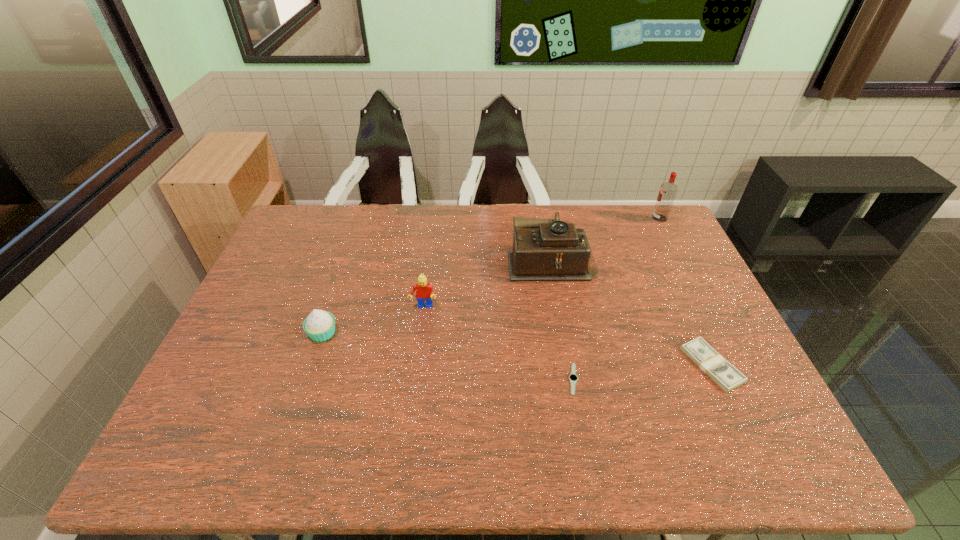
Where is `vacant space at the near left corner of the desktop`? vacant space at the near left corner of the desktop is located at coordinates (190, 461).

This screenshot has height=540, width=960. In the image, there is a desktop. In order to click on vacant region at the far right corner in this screenshot , I will do 647,224.

Image resolution: width=960 pixels, height=540 pixels. I want to click on empty location between the fifth object from right to left and the cupcake, so click(373, 320).

Where is `free space between the third farthest object and the second shortest object`? free space between the third farthest object and the second shortest object is located at coordinates (567, 336).

You are a GUI agent. You are given a task and a screenshot of the screen. Output one action in this format:
    pyautogui.click(x=<x>, y=<y>)
    Task: Click on the free space between the second shortest object and the shortest object
    This screenshot has height=540, width=960.
    Given the screenshot: What is the action you would take?
    pyautogui.click(x=642, y=372)

In order to click on vacant space that is in between the watch and the second shortest object in this screenshot , I will do `click(642, 372)`.

You are a GUI agent. You are given a task and a screenshot of the screen. Output one action in this format:
    pyautogui.click(x=<x>, y=<y>)
    Task: Click on the vacant area between the third shortest object and the third tallest object
    Image resolution: width=960 pixels, height=540 pixels.
    Given the screenshot: What is the action you would take?
    pyautogui.click(x=373, y=320)

Locate an element on the screen. The image size is (960, 540). blank region between the cupcake and the fifth nearest object is located at coordinates (437, 297).

You are a GUI agent. You are given a task and a screenshot of the screen. Output one action in this format:
    pyautogui.click(x=<x>, y=<y>)
    Task: Click on the vacant space that is in between the fifth tallest object and the fourth shortest object
    
    Given the screenshot: What is the action you would take?
    pyautogui.click(x=567, y=336)

Locate an element on the screen. This screenshot has width=960, height=540. empty location between the fourth shortest object and the watch is located at coordinates [498, 343].